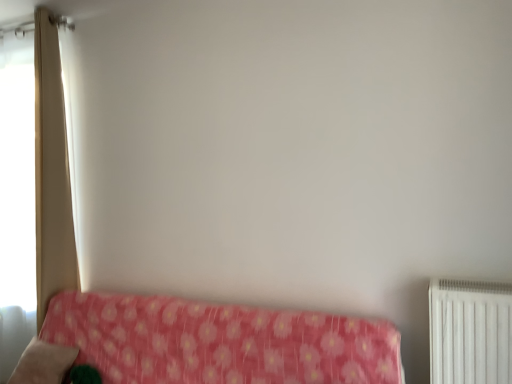
Question: Can you confirm if beige fabric curtain at left is positioned to the right of soft pink fabric pillow at lower left?

Choices:
 (A) no
 (B) yes

Answer: (A)

Question: Is beige fabric curtain at left smaller than soft pink fabric pillow at lower left?

Choices:
 (A) no
 (B) yes

Answer: (A)

Question: From the image's perspective, is beige fabric curtain at left on top of soft pink fabric pillow at lower left?

Choices:
 (A) yes
 (B) no

Answer: (A)

Question: Considering the relative positions of beige fabric curtain at left and soft pink fabric pillow at lower left in the image provided, is beige fabric curtain at left in front of soft pink fabric pillow at lower left?

Choices:
 (A) no
 (B) yes

Answer: (A)

Question: Does beige fabric curtain at left have a greater height compared to soft pink fabric pillow at lower left?

Choices:
 (A) no
 (B) yes

Answer: (B)

Question: Relative to pink floral fabric at lower left, is soft pink fabric pillow at lower left in front or behind?

Choices:
 (A) front
 (B) behind

Answer: (B)

Question: Looking at the image, does soft pink fabric pillow at lower left seem bigger or smaller compared to pink floral fabric at lower left?

Choices:
 (A) small
 (B) big

Answer: (A)

Question: From a real-world perspective, is soft pink fabric pillow at lower left positioned above or below pink floral fabric at lower left?

Choices:
 (A) above
 (B) below

Answer: (B)

Question: In terms of width, does soft pink fabric pillow at lower left look wider or thinner when compared to pink floral fabric at lower left?

Choices:
 (A) wide
 (B) thin

Answer: (B)

Question: Considering the positions of point (79, 311) and point (53, 91), is point (79, 311) closer or farther from the camera than point (53, 91)?

Choices:
 (A) closer
 (B) farther

Answer: (A)

Question: From their relative heights in the image, would you say pink floral fabric at lower left is taller or shorter than beige fabric curtain at left?

Choices:
 (A) tall
 (B) short

Answer: (B)

Question: From a real-world perspective, is pink floral fabric at lower left above or below beige fabric curtain at left?

Choices:
 (A) above
 (B) below

Answer: (B)

Question: Is pink floral fabric at lower left inside the boundaries of beige fabric curtain at left, or outside?

Choices:
 (A) outside
 (B) inside

Answer: (A)

Question: From a real-world perspective, is beige fabric curtain at left physically located above or below pink floral fabric at lower left?

Choices:
 (A) below
 (B) above

Answer: (B)

Question: Is beige fabric curtain at left situated inside pink floral fabric at lower left or outside?

Choices:
 (A) inside
 (B) outside

Answer: (B)